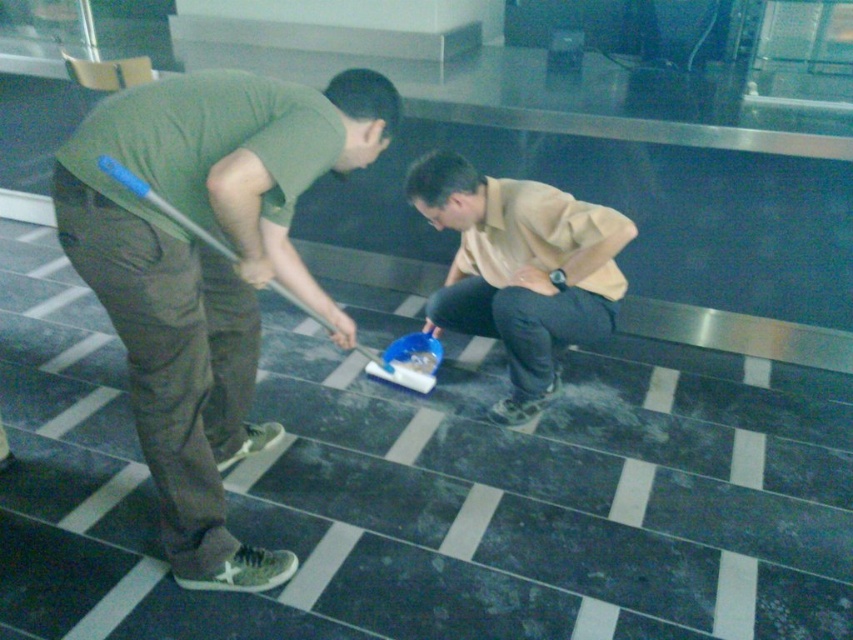
You are a photographer setting up a shot of the two cleaners. The camera frame is already positioned to include both the green matte shirt at center and the beige cotton shirt at center. Do you think adjusting the camera to focus on the wider of the two shirts will automatically keep the narrower one in frame?

The green matte shirt at center might be wider than beige cotton shirt at center, so focusing on the wider shirt could still keep the narrower one in frame if their positions allow it, but this depends on the camera angle and zoom level.

You are a cleaning supervisor who needs to ensure social distancing guidelines are followed. The minimum required distance between workers is 30 inches. Based on the scene, are the two workers, wearing the green matte shirt at center and beige cotton shirt at center, maintaining the required distance?

The distance between the green matte shirt at center and beige cotton shirt at center is 28.05 inches, which is less than the required 30 inches. Therefore, they are not maintaining the required social distancing guidelines.

You are standing at the point marked as point (207,272). What object are you currently standing on?

You are standing on the green matte shirt at center, as the point (207,272) is located on it.